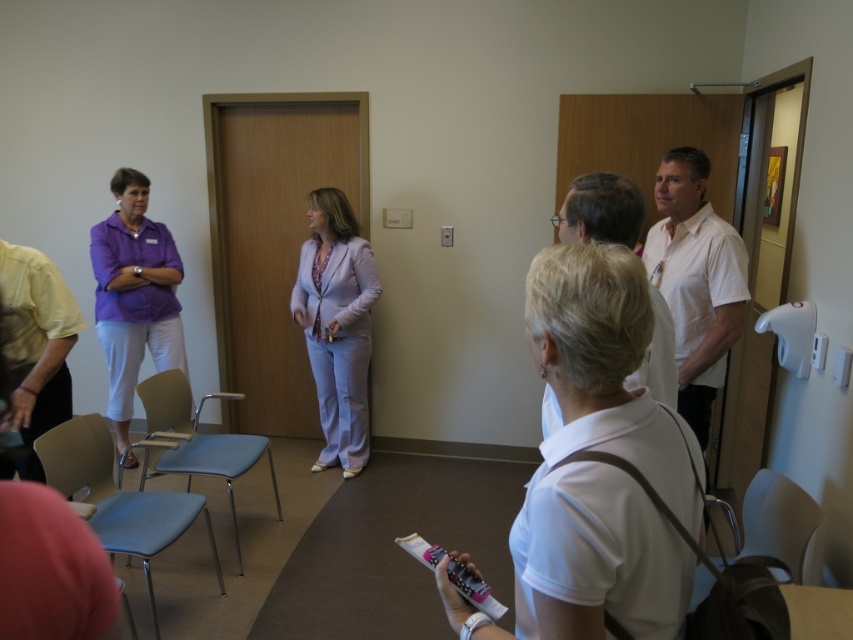
Where is `purple matte shirt at left`? purple matte shirt at left is located at coordinates (134, 296).

Which of these two, purple matte shirt at left or light blue fabric chair at center, stands shorter?

light blue fabric chair at center is shorter.

Describe the element at coordinates (134, 296) in the screenshot. I see `purple matte shirt at left` at that location.

Find the location of `purple matte shirt at left`. purple matte shirt at left is located at coordinates (134, 296).

Does point (347, 419) come in front of point (178, 515)?

No, it is not.

Who is positioned more to the right, lavender fabric suit at center or light blue plastic chair at lower left?

lavender fabric suit at center is more to the right.

Which is in front, point (367, 369) or point (97, 436)?

Point (97, 436) is more forward.

I want to click on lavender fabric suit at center, so [x=335, y=324].

Does white matte shirt at center have a greater width compared to wooden elevator at center?

In fact, white matte shirt at center might be narrower than wooden elevator at center.

Between point (691, 509) and point (265, 362), which one is positioned in front?

Point (691, 509) is more forward.

This screenshot has height=640, width=853. I want to click on white matte shirt at center, so click(x=598, y=464).